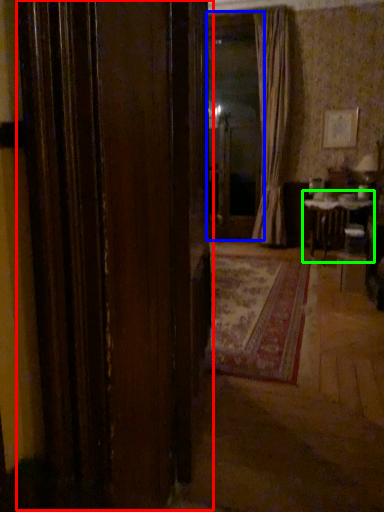
Question: Estimate the real-world distances between objects in this image. Which object is closer to door (highlighted by a red box), window screen (highlighted by a blue box) or table (highlighted by a green box)?

Choices:
 (A) window screen
 (B) table

Answer: (B)